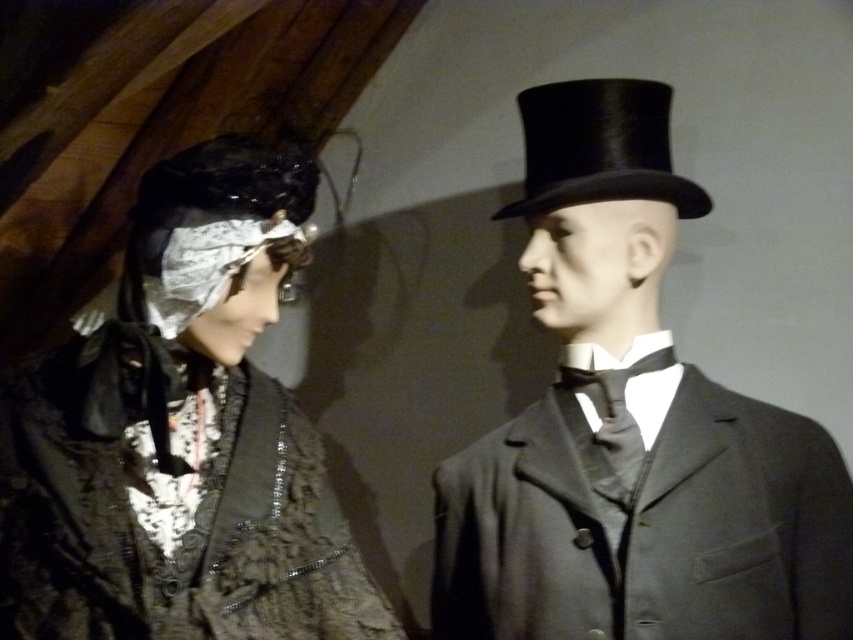
Question: Which point is farther to the camera?

Choices:
 (A) (543, 304)
 (B) (537, 100)
 (C) (79, 372)

Answer: (A)

Question: Does shiny black top hat at right appear on the right side of matte black lace dress at left?

Choices:
 (A) yes
 (B) no

Answer: (A)

Question: Which point is closer to the camera taking this photo?

Choices:
 (A) (569, 88)
 (B) (77, 390)
 (C) (624, 154)

Answer: (B)

Question: Is shiny black top hat at right to the left of black silk top hat at upper right from the viewer's perspective?

Choices:
 (A) yes
 (B) no

Answer: (B)

Question: Which of the following is the farthest from the observer?

Choices:
 (A) (602, 138)
 (B) (166, 342)

Answer: (A)

Question: Where is shiny black top hat at right located in relation to matte black lace dress at left in the image?

Choices:
 (A) left
 (B) right

Answer: (B)